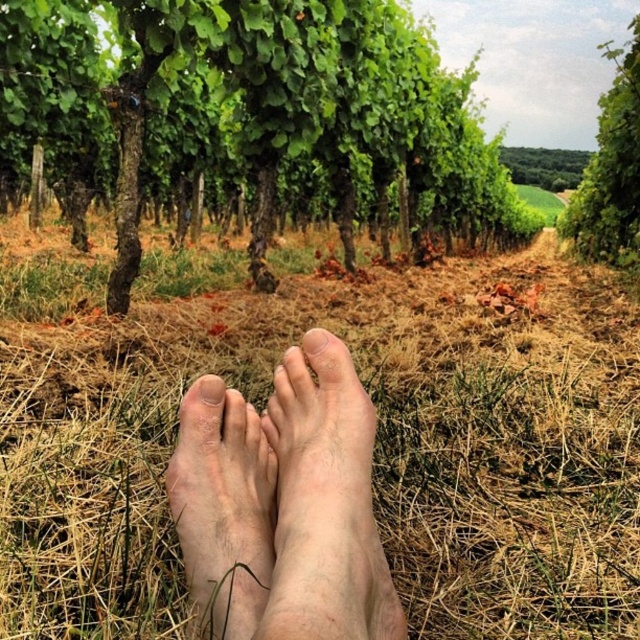
In the scene shown: Who is lower down, pale skin barefoot at center or dry skin foot at center?

Positioned lower is pale skin barefoot at center.

From the picture: Who is shorter, pale skin barefoot at center or dry skin foot at center?

With less height is dry skin foot at center.

Describe the element at coordinates (324, 506) in the screenshot. I see `pale skin barefoot at center` at that location.

At what (x,y) coordinates should I click in order to perform the action: click on pale skin barefoot at center. Please return your answer as a coordinate pair (x, y). Image resolution: width=640 pixels, height=640 pixels. Looking at the image, I should click on (324, 506).

Between green leafy tree at center and green leafy tree at upper right, which one appears on the left side from the viewer's perspective?

green leafy tree at center

Describe the element at coordinates (252, 120) in the screenshot. The width and height of the screenshot is (640, 640). I see `green leafy tree at center` at that location.

Describe the element at coordinates (252, 120) in the screenshot. I see `green leafy tree at center` at that location.

I want to click on green leafy tree at center, so click(252, 120).

Between point (196, 595) and point (593, 157), which one is positioned in front?

Positioned in front is point (196, 595).

Does point (240, 605) come farther from viewer compared to point (605, 129)?

No, it is in front of (605, 129).

Locate an element on the screen. dry skin foot at center is located at coordinates (224, 509).